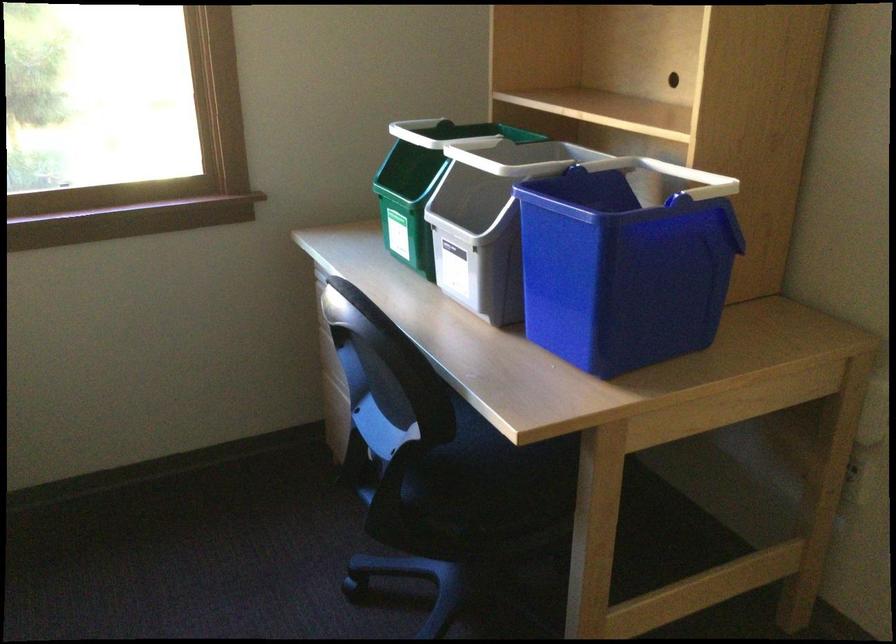
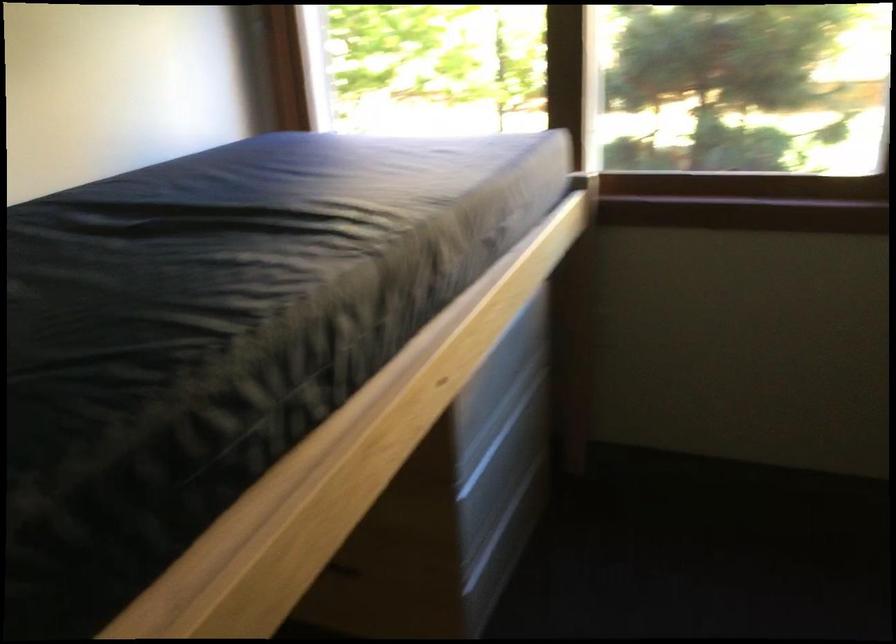
Question: The camera is either moving clockwise (left) or counter-clockwise (right) around the object. The first image is from the beginning of the video and the second image is from the end. Is the camera moving left or right when shooting the video?

Choices:
 (A) Left
 (B) Right

Answer: (B)